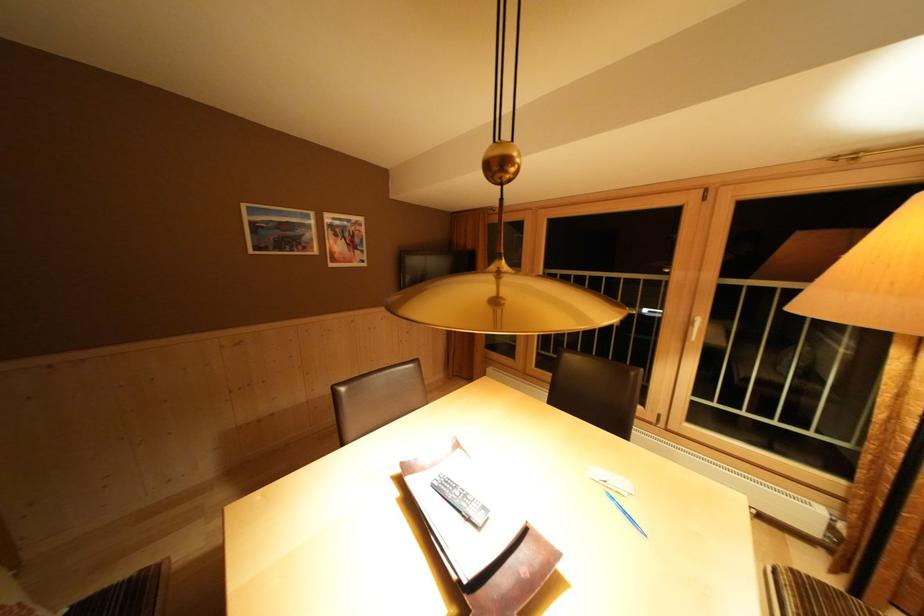
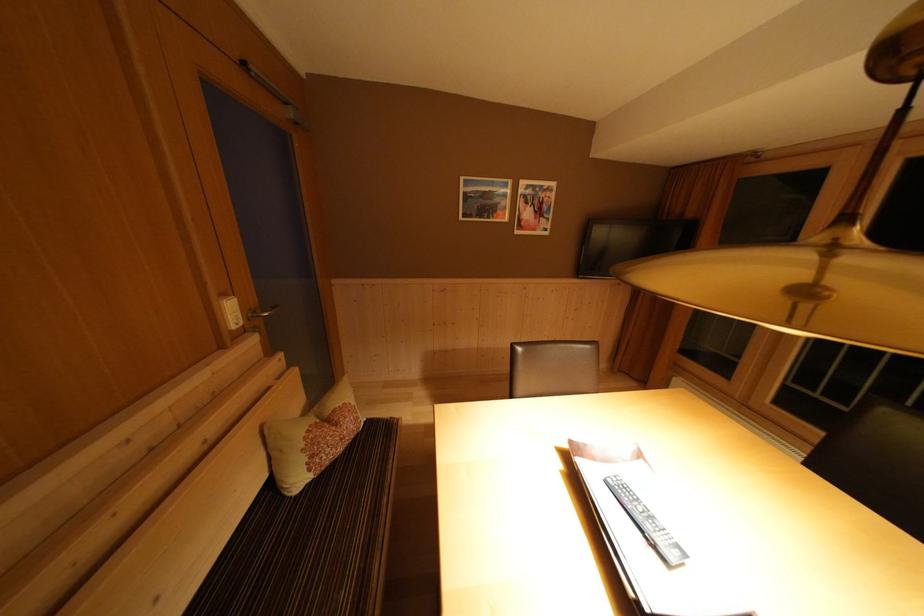
The point at (442, 488) is marked in the first image. Where is the corresponding point in the second image?

(617, 485)